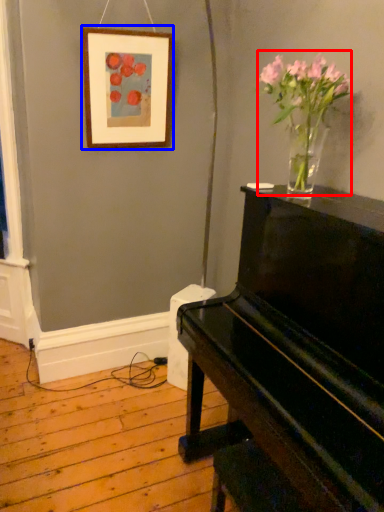
Question: Which of the following is the closest to the observer, floral arrangement (highlighted by a red box) or picture frame (highlighted by a blue box)?

Choices:
 (A) floral arrangement
 (B) picture frame

Answer: (A)